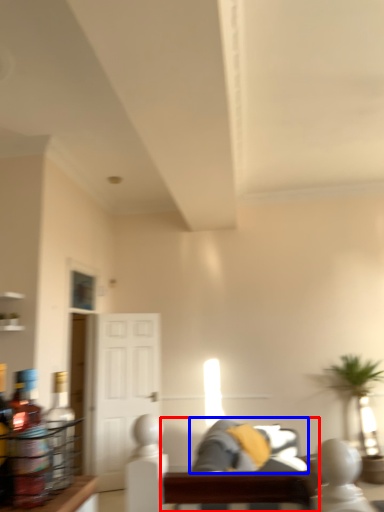
Question: Which object is further to the camera taking this photo, couch (highlighted by a red box) or couch (highlighted by a blue box)?

Choices:
 (A) couch
 (B) couch

Answer: (B)